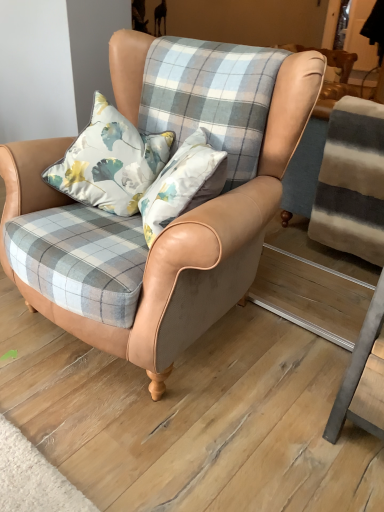
You are a GUI agent. You are given a task and a screenshot of the screen. Output one action in this format:
    pyautogui.click(x=<x>, y=<y>)
    Task: Click on the floral satin pillow at center
    The height and width of the screenshot is (512, 384).
    Given the screenshot: What is the action you would take?
    pyautogui.click(x=110, y=162)

This screenshot has width=384, height=512. What do you see at coordinates (110, 162) in the screenshot?
I see `floral satin pillow at center` at bounding box center [110, 162].

The width and height of the screenshot is (384, 512). What do you see at coordinates (172, 223) in the screenshot?
I see `leather armchair at center` at bounding box center [172, 223].

Find the location of `leather armchair at center`. leather armchair at center is located at coordinates pos(172,223).

At what (x,y) coordinates should I click in order to perform the action: click on floral satin pillow at center. Please return your answer as a coordinate pair (x, y). This screenshot has height=512, width=384. Looking at the image, I should click on (110, 162).

Can you confirm if floral satin pillow at center is positioned to the right of leather armchair at center?

No, floral satin pillow at center is not to the right of leather armchair at center.

Considering the relative positions of floral satin pillow at center and leather armchair at center in the image provided, is floral satin pillow at center in front of leather armchair at center?

No, floral satin pillow at center is behind leather armchair at center.

Is point (130, 211) closer to camera compared to point (167, 286)?

No.

From the image's perspective, which is below, floral satin pillow at center or leather armchair at center?

leather armchair at center is shown below in the image.

From a real-world perspective, which object stands above the other?

From a 3D spatial view, floral satin pillow at center is above.

Considering the sizes of floral satin pillow at center and leather armchair at center in the image, is floral satin pillow at center wider or thinner than leather armchair at center?

In the image, floral satin pillow at center appears to be more narrow than leather armchair at center.

Considering the relative sizes of floral satin pillow at center and leather armchair at center in the image provided, is floral satin pillow at center taller than leather armchair at center?

Incorrect, the height of floral satin pillow at center is not larger of that of leather armchair at center.

Between floral satin pillow at center and leather armchair at center, which one has smaller size?

floral satin pillow at center is smaller.

Could leather armchair at center be considered to be inside floral satin pillow at center?

No, leather armchair at center is located outside of floral satin pillow at center.

Based on the photo, are floral satin pillow at center and leather armchair at center making contact?

No, floral satin pillow at center is not with leather armchair at center.

Could you tell me if floral satin pillow at center is turned towards leather armchair at center?

Yes, floral satin pillow at center is facing leather armchair at center.

What's the angular difference between floral satin pillow at center and leather armchair at center's facing directions?

41 degrees.

Locate an element on the screen. chair below the floral satin pillow at center (from a real-world perspective) is located at coordinates (172, 223).

Is leather armchair at center at the right side of floral satin pillow at center?

Yes, leather armchair at center is to the right of floral satin pillow at center.

Considering the positions of objects leather armchair at center and floral satin pillow at center in the image provided, who is behind, leather armchair at center or floral satin pillow at center?

floral satin pillow at center is more distant.

Does point (118, 49) come farther from viewer compared to point (125, 146)?

Yes, it is.

From the image's perspective, is leather armchair at center on top of floral satin pillow at center?

No, from the image's perspective, leather armchair at center is not above floral satin pillow at center.

From a real-world perspective, which object rests below the other?

From a 3D spatial view, leather armchair at center is below.

Considering the sizes of objects leather armchair at center and floral satin pillow at center in the image provided, who is wider, leather armchair at center or floral satin pillow at center?

With larger width is leather armchair at center.

Can you confirm if leather armchair at center is taller than floral satin pillow at center?

Correct, leather armchair at center is much taller as floral satin pillow at center.

Based on the photo, who is bigger, leather armchair at center or floral satin pillow at center?

leather armchair at center is bigger.

Is leather armchair at center not within floral satin pillow at center?

Yes, leather armchair at center is located beyond the bounds of floral satin pillow at center.

Is leather armchair at center far away from floral satin pillow at center?

That's not correct — leather armchair at center is a little close to floral satin pillow at center.

Is leather armchair at center looking in the opposite direction of floral satin pillow at center?

Yes, leather armchair at center is facing away from floral satin pillow at center.

Looking at this image, measure the distance from leather armchair at center to floral satin pillow at center.

leather armchair at center is 24.98 centimeters from floral satin pillow at center.

Image resolution: width=384 pixels, height=512 pixels. Identify the location of pillow behind the leather armchair at center. (110, 162).

You are a GUI agent. You are given a task and a screenshot of the screen. Output one action in this format:
    pyautogui.click(x=<x>, y=<y>)
    Task: Click on the chair located on the right of floral satin pillow at center
    
    Given the screenshot: What is the action you would take?
    pyautogui.click(x=172, y=223)

Where is `pillow that appears behind the leather armchair at center`? pillow that appears behind the leather armchair at center is located at coordinates (110, 162).